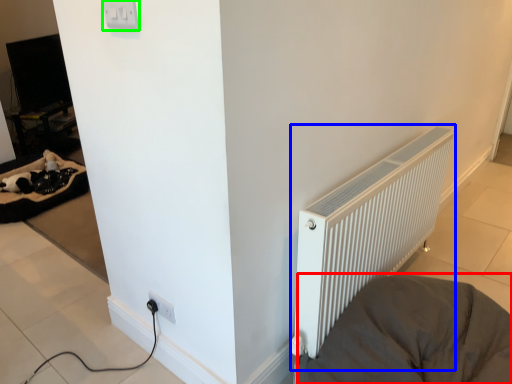
Question: Considering the real-world distances, which object is farthest from furniture (highlighted by a red box)? radiator (highlighted by a blue box) or electric outlet (highlighted by a green box)?

Choices:
 (A) radiator
 (B) electric outlet

Answer: (B)